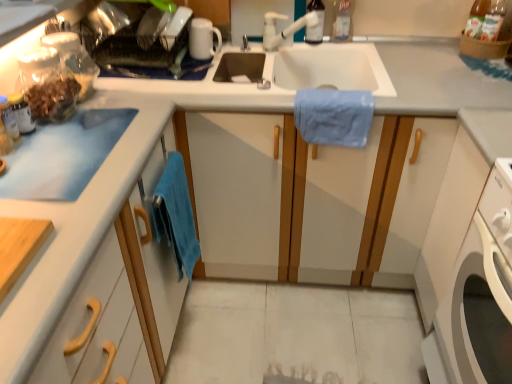
Question: Considering the positions of matte plastic container at upper left and white plastic faucet at upper center in the image, is matte plastic container at upper left bigger or smaller than white plastic faucet at upper center?

Choices:
 (A) big
 (B) small

Answer: (B)

Question: Considering the positions of point (70, 1) and point (271, 18), is point (70, 1) closer or farther from the camera than point (271, 18)?

Choices:
 (A) farther
 (B) closer

Answer: (B)

Question: Which object is the closest to the translucent plastic bottle at upper center, positioned as the 1th bottle in right-to-left order?

Choices:
 (A) transparent plastic bottle at upper center, the first bottle from the left
 (B) white glossy mug at upper center
 (C) white plastic washing machine at lower right
 (D) blue cotton towel at center, arranged as the first bath towel when viewed from the top
 (E) white matte cabinet at left

Answer: (A)

Question: Estimate the real-world distances between objects in this image. Which object is closer to the matte plastic container at upper left?

Choices:
 (A) white plastic washing machine at lower right
 (B) white glossy mug at upper center
 (C) translucent plastic bottle at upper center, positioned as the 1th bottle in right-to-left order
 (D) white matte cabinet at left
 (E) blue cotton towel at lower left, the 1th bath towel from the left

Answer: (B)